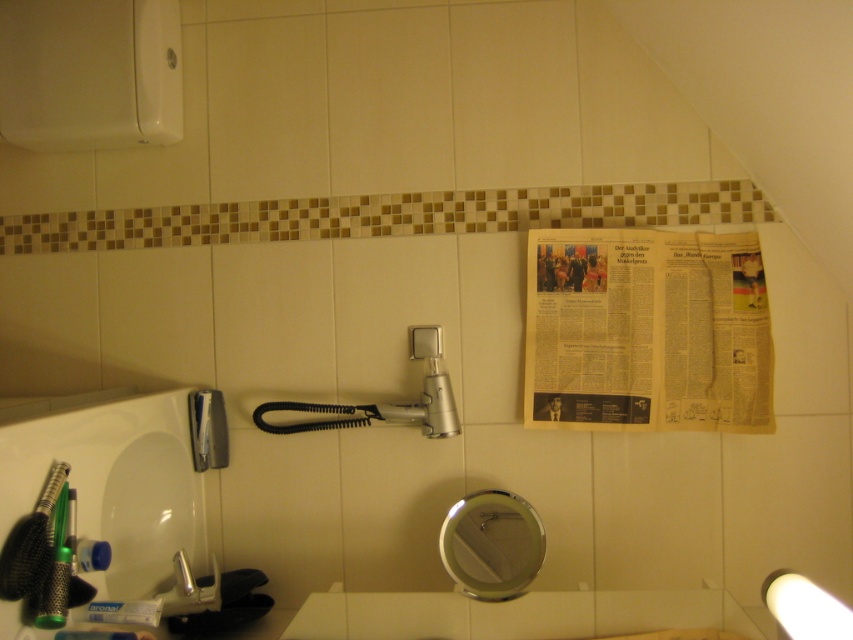
You are organizing the bathroom and need to place both the white glossy sink at lower left and the white plastic toothpaste at lower left. Since they are both at the lower left, which one takes up more space?

The white glossy sink at lower left is bigger than the white plastic toothpaste at lower left, so it takes up more space.

You are a cleaning robot with a 3.5 feet reach. You need to clean the yellowed newspaper at upper right. Can you reach it?

The yellowed newspaper at upper right is 3.64 feet away from the camera, so the robot cannot reach it since its maximum reach is 3.5 feet.

You are standing in the bathroom and want to place a small decorative item between the two points labeled as point (148, 600) and point (117, 630). Based on their positions, which point is closer to you, and where should you place the item to ensure it is between them?

Point (117, 630) is closer to you. To place the item between them, position it closer to point (117, 630) but still between both points since point (148, 600) is behind point (117, 630).